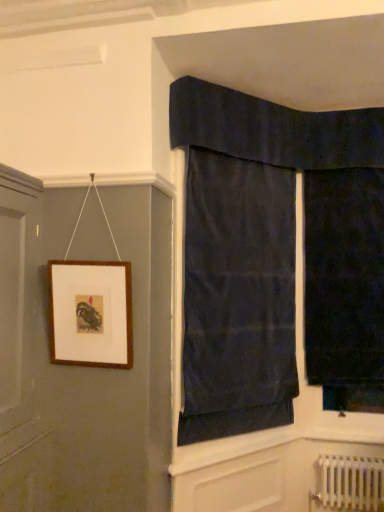
Question: Would you say brown wooden picture frame at upper left is outside white metallic radiator at lower right?

Choices:
 (A) yes
 (B) no

Answer: (A)

Question: From the image's perspective, is brown wooden picture frame at upper left on white metallic radiator at lower right?

Choices:
 (A) no
 (B) yes

Answer: (B)

Question: Can you confirm if brown wooden picture frame at upper left is positioned to the right of white metallic radiator at lower right?

Choices:
 (A) yes
 (B) no

Answer: (B)

Question: Can you confirm if brown wooden picture frame at upper left is shorter than white metallic radiator at lower right?

Choices:
 (A) no
 (B) yes

Answer: (A)

Question: Is brown wooden picture frame at upper left next to white metallic radiator at lower right?

Choices:
 (A) yes
 (B) no

Answer: (B)

Question: Considering the relative sizes of brown wooden picture frame at upper left and white metallic radiator at lower right in the image provided, is brown wooden picture frame at upper left thinner than white metallic radiator at lower right?

Choices:
 (A) yes
 (B) no

Answer: (A)

Question: Is dark velvet curtain at right, the first curtain when ordered from right to left, to the left of brown wooden picture frame at upper left from the viewer's perspective?

Choices:
 (A) no
 (B) yes

Answer: (A)

Question: Would you say brown wooden picture frame at upper left is part of dark velvet curtain at right, the second curtain in the left-to-right sequence,'s contents?

Choices:
 (A) yes
 (B) no

Answer: (B)

Question: Is dark velvet curtain at right, the second curtain in the left-to-right sequence, located outside brown wooden picture frame at upper left?

Choices:
 (A) no
 (B) yes

Answer: (B)

Question: Would you consider dark velvet curtain at right, the second curtain in the left-to-right sequence, to be distant from brown wooden picture frame at upper left?

Choices:
 (A) yes
 (B) no

Answer: (A)

Question: Considering the relative positions of dark velvet curtain at right, the second curtain in the left-to-right sequence, and brown wooden picture frame at upper left in the image provided, is dark velvet curtain at right, the second curtain in the left-to-right sequence, in front of brown wooden picture frame at upper left?

Choices:
 (A) no
 (B) yes

Answer: (A)

Question: Is dark velvet curtain at right, the first curtain when ordered from right to left, aimed at brown wooden picture frame at upper left?

Choices:
 (A) yes
 (B) no

Answer: (B)

Question: Is dark blue fabric at upper center, the 1th curtain from the left, thinner than white metallic radiator at lower right?

Choices:
 (A) no
 (B) yes

Answer: (B)